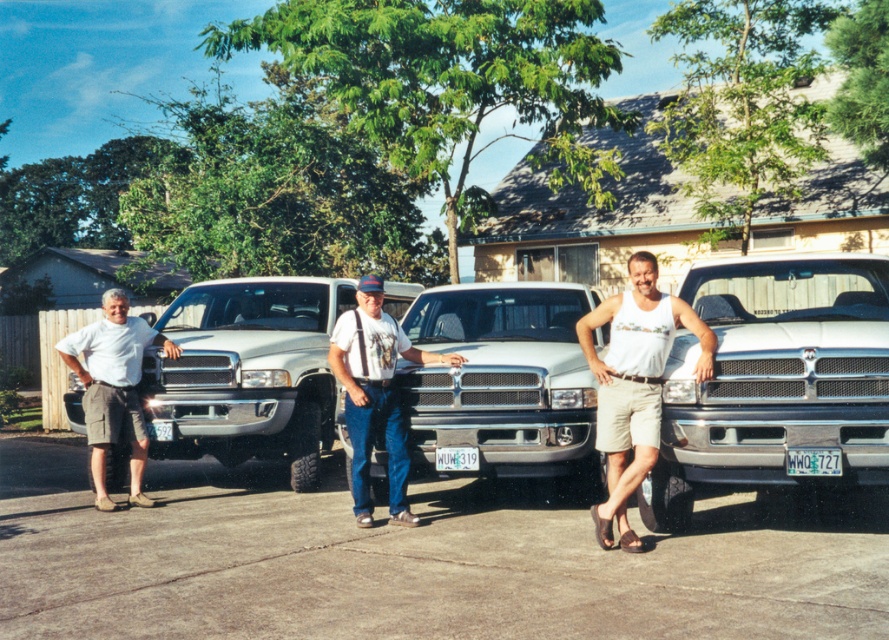
Question: Which of these objects is positioned farthest from the silver metallic pickup truck at center?

Choices:
 (A) white matte truck at center
 (B) denim pants at center

Answer: (B)

Question: Does silver metallic pickup truck at center have a greater width compared to matte silver pickup truck at center?

Choices:
 (A) yes
 (B) no

Answer: (A)

Question: Does silver metallic pickup truck at center appear over white tank top at center?

Choices:
 (A) yes
 (B) no

Answer: (A)

Question: Which of the following is the farthest from the observer?

Choices:
 (A) light gray cotton shorts at left
 (B) matte silver pickup truck at center
 (C) denim pants at center

Answer: (A)

Question: Which of the following is the farthest from the observer?

Choices:
 (A) (779, 468)
 (B) (116, 432)

Answer: (B)

Question: Is white matte truck at center wider than light gray cotton shorts at left?

Choices:
 (A) yes
 (B) no

Answer: (A)